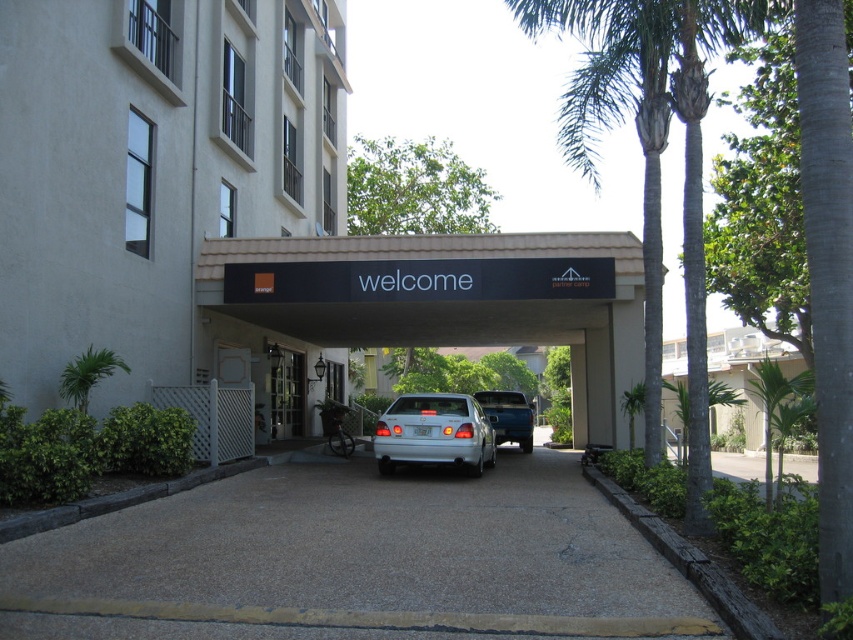
You are a delivery person arriving at the entrance. You need to park your metallic silver truck at center in a spot that is not under the matte white building at center. Where should you park the truck?

The matte white building at center is located above the metallic silver truck at center, which means the truck is parked under the building. To avoid parking under the building, you should move the truck to a spot that is not underneath the matte white building at center, such as the open area beside the white picket fence on the left or near the palm trees.

You are standing in front of the entrance and want to enter the building. Which object should you approach first, the matte white building at center or the clear glass door at center?

You should approach the clear glass door at center first because the matte white building at center is in front of it, meaning the door is likely the entrance point.